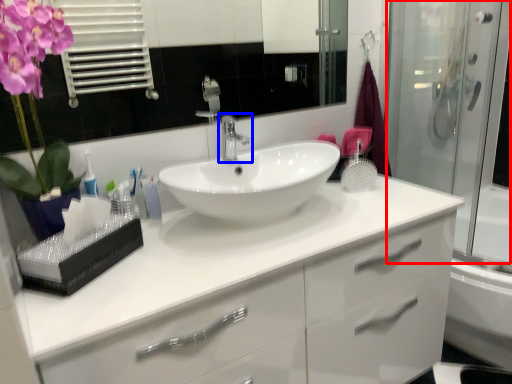
Question: Which object appears farthest to the camera in this image, screen door (highlighted by a red box) or tap (highlighted by a blue box)?

Choices:
 (A) screen door
 (B) tap

Answer: (B)